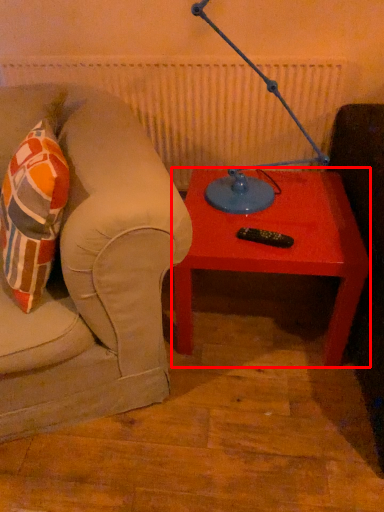
Question: From the image's perspective, what is the correct spatial positioning of table (annotated by the red box) in reference to table lamp?

Choices:
 (A) below
 (B) above

Answer: (A)